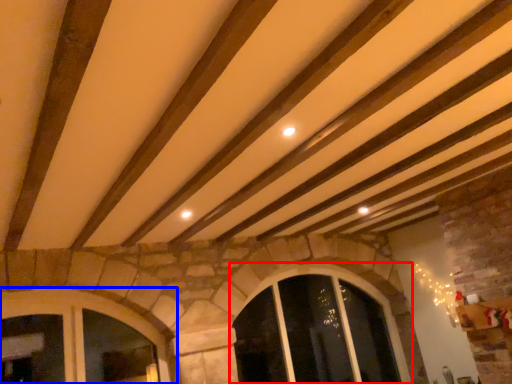
Question: Which object is closer to the camera taking this photo, window (highlighted by a red box) or window (highlighted by a blue box)?

Choices:
 (A) window
 (B) window

Answer: (B)